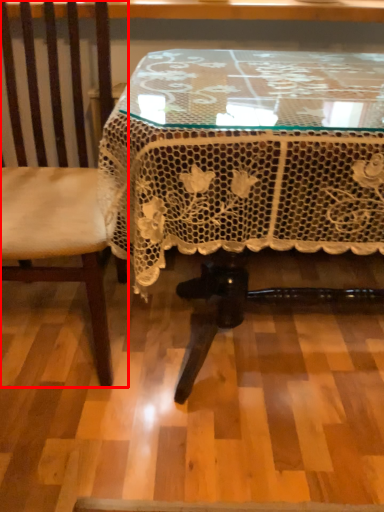
Question: Considering the relative positions of chair (annotated by the red box) and table in the image provided, where is chair (annotated by the red box) located with respect to the staircase?

Choices:
 (A) left
 (B) right

Answer: (A)